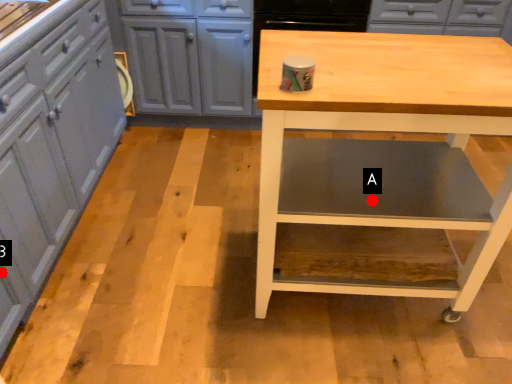
Question: Two points are circled on the image, labeled by A and B beside each circle. Which point is closer to the camera?

Choices:
 (A) A is closer
 (B) B is closer

Answer: (A)